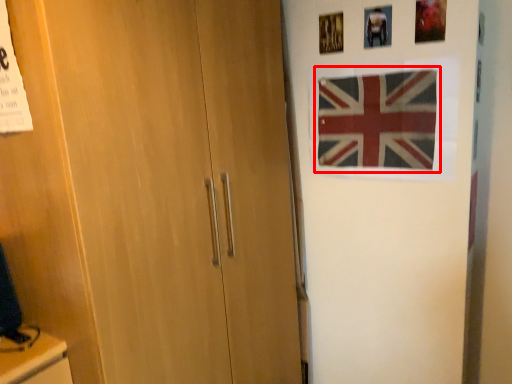
Question: From the image's perspective, considering the relative positions of flag (annotated by the red box) and picture frame in the image provided, where is flag (annotated by the red box) located with respect to the staircase?

Choices:
 (A) above
 (B) below

Answer: (B)